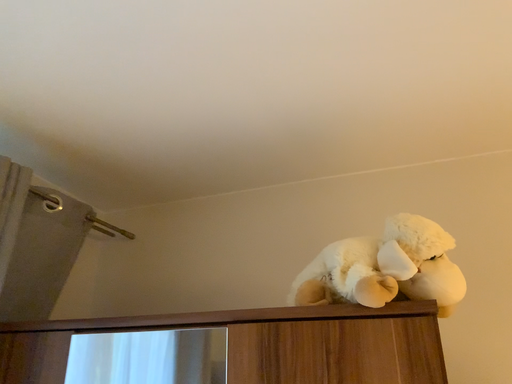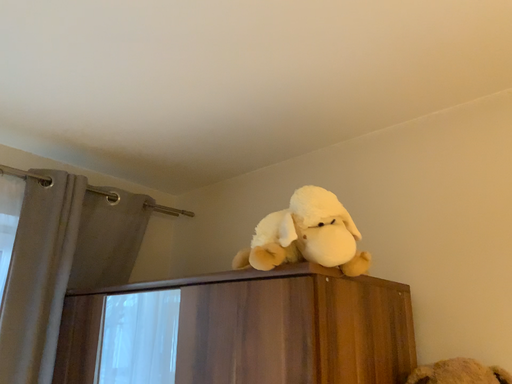
Question: Which way did the camera rotate in the video?

Choices:
 (A) rotated downward
 (B) rotated upward

Answer: (A)